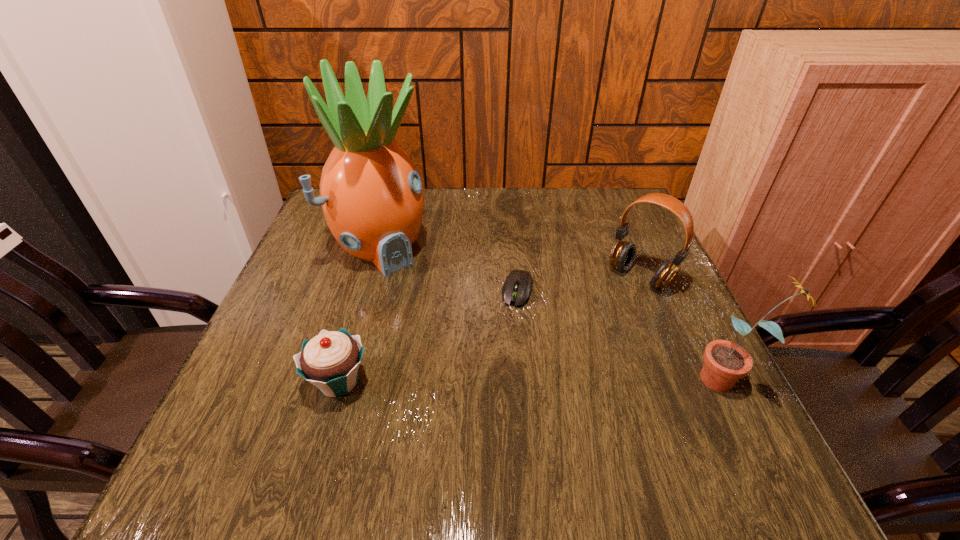
Find the location of a particular element. Image resolution: width=960 pixels, height=540 pixels. cupcake is located at coordinates (330, 361).

Image resolution: width=960 pixels, height=540 pixels. What are the coordinates of `sunflower` in the screenshot? It's located at (725, 362).

Find the location of a particular element. This screenshot has height=540, width=960. pineapple is located at coordinates (372, 197).

Where is `the third shortest object`? This screenshot has width=960, height=540. the third shortest object is located at coordinates (623, 253).

Locate an element on the screen. This screenshot has width=960, height=540. the third object from left to right is located at coordinates (518, 285).

You are a GUI agent. You are given a task and a screenshot of the screen. Output one action in this format:
    pyautogui.click(x=<x>, y=<y>)
    Task: Click on the shortest object
    This screenshot has width=960, height=540.
    Given the screenshot: What is the action you would take?
    pyautogui.click(x=518, y=285)

In order to click on free region located on the right of the cupcake in this screenshot , I will do `click(398, 382)`.

The width and height of the screenshot is (960, 540). In order to click on vacant space located on the flower of the sunflower in this screenshot , I will do `click(572, 379)`.

Identify the location of free point located 0.270m on the flower of the sunflower. (551, 379).

Locate an element on the screen. Image resolution: width=960 pixels, height=540 pixels. vacant space located 0.360m on the flower of the sunflower is located at coordinates (503, 379).